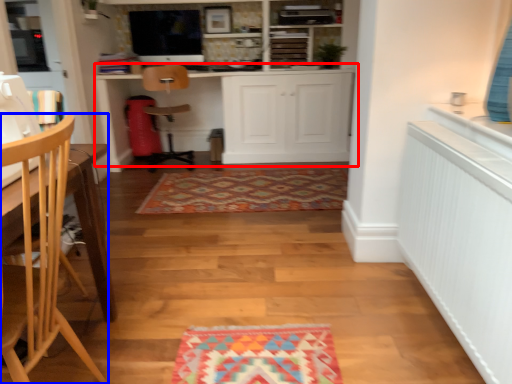
Question: Among these objects, which one is farthest to the camera, cabinetry (highlighted by a red box) or chair (highlighted by a blue box)?

Choices:
 (A) cabinetry
 (B) chair

Answer: (A)